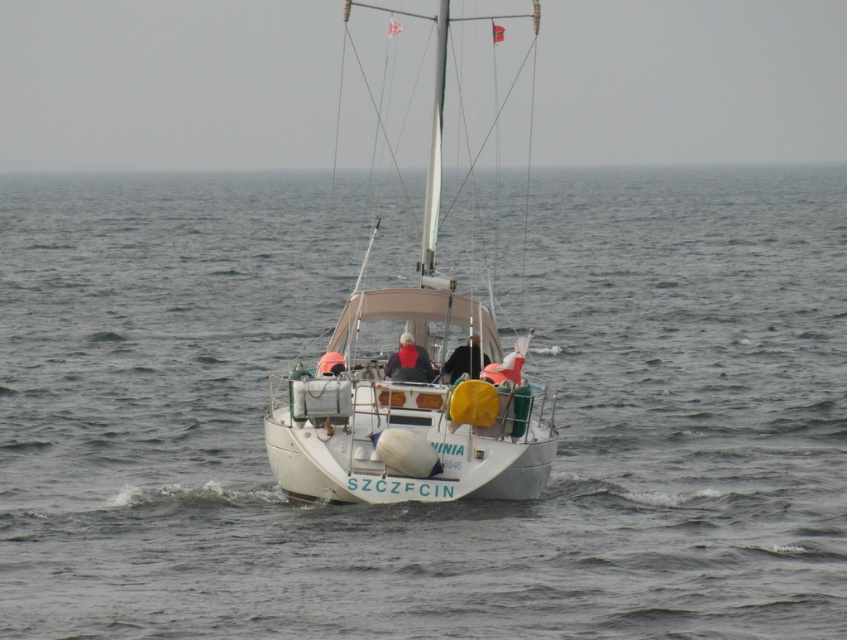
Question: Which of the following is the farthest from the observer?

Choices:
 (A) 169,381
 (B) 418,392
 (C) 464,369

Answer: (A)

Question: Does white matte sailboat at center lie behind dark blue fabric jacket at center?

Choices:
 (A) no
 (B) yes

Answer: (A)

Question: Among these points, which one is nearest to the camera?

Choices:
 (A) (416, 369)
 (B) (457, 349)
 (C) (369, 387)

Answer: (C)

Question: Among these objects, which one is nearest to the camera?

Choices:
 (A) black fabric jacket at center
 (B) gray water at center

Answer: (B)

Question: Does gray water at center have a lesser width compared to white matte sailboat at center?

Choices:
 (A) no
 (B) yes

Answer: (A)

Question: Does dark blue fabric jacket at center appear under black fabric jacket at center?

Choices:
 (A) no
 (B) yes

Answer: (A)